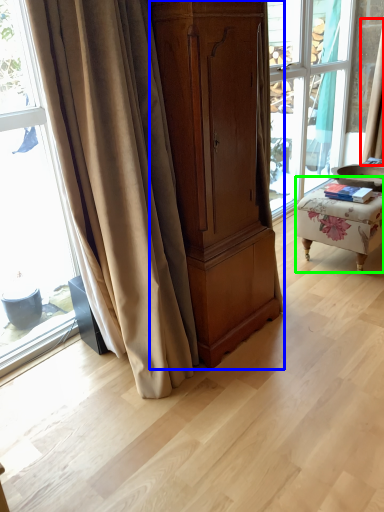
Question: Estimate the real-world distances between objects in this image. Which object is closer to curtain (highlighted by a red box), cabinetry (highlighted by a blue box) or furniture (highlighted by a green box)?

Choices:
 (A) cabinetry
 (B) furniture

Answer: (B)